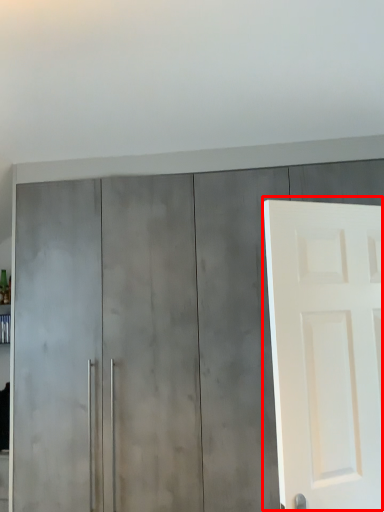
Question: From the image's perspective, what is the correct spatial relationship of door (annotated by the red box) in relation to cupboard?

Choices:
 (A) below
 (B) above

Answer: (B)